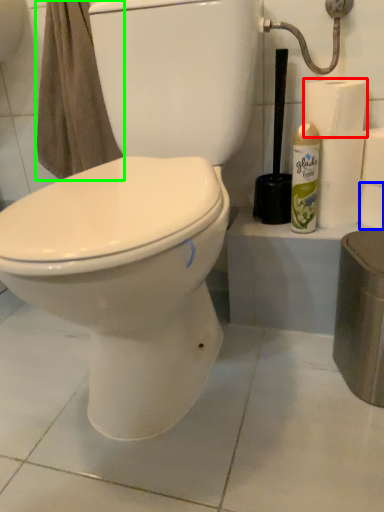
Question: Estimate the real-world distances between objects in this image. Which object is closer to toilet paper (highlighted by a red box), toilet paper (highlighted by a blue box) or bath towel (highlighted by a green box)?

Choices:
 (A) toilet paper
 (B) bath towel

Answer: (A)